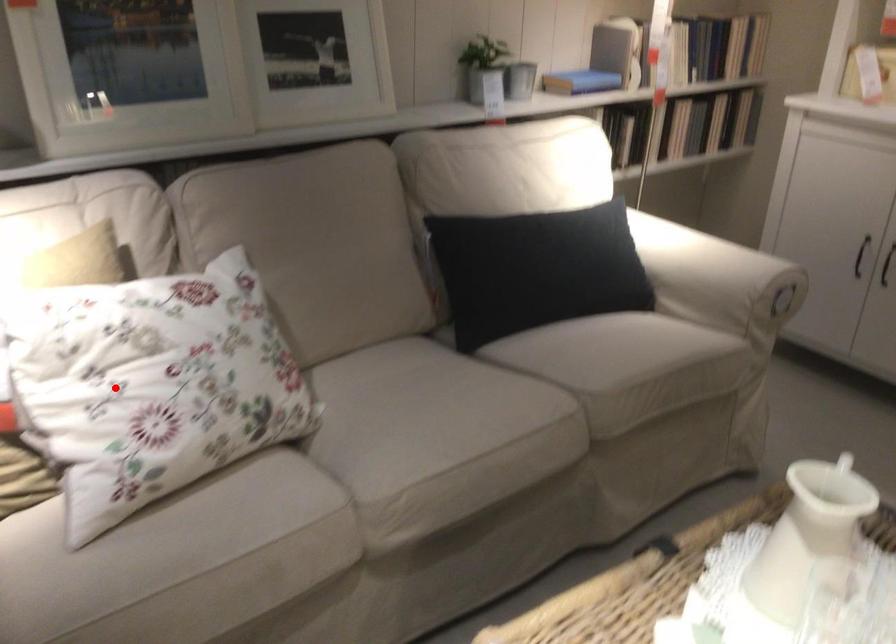
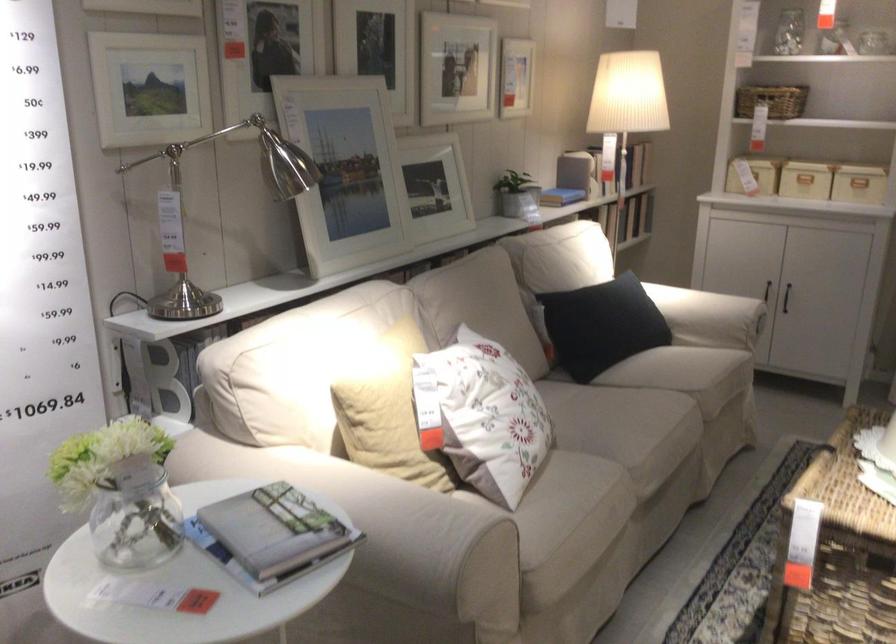
Question: A red point is marked in image1. In image2, is the corresponding 3D point closer to the camera or farther? Reply with the corresponding letter.

Choices:
 (A) The corresponding 3D point is closer.
 (B) The corresponding 3D point is farther.

Answer: (B)